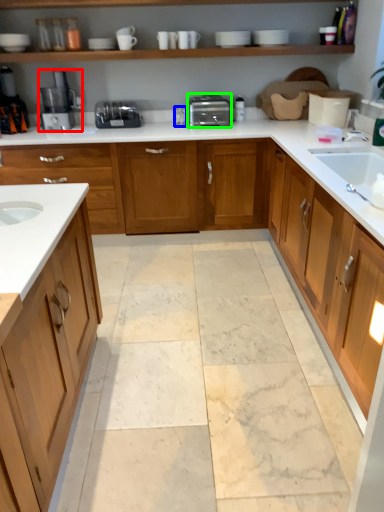
Question: Which is farther away from home appliance (highlighted by a red box)? faucet (highlighted by a blue box) or toaster (highlighted by a green box)?

Choices:
 (A) faucet
 (B) toaster

Answer: (B)